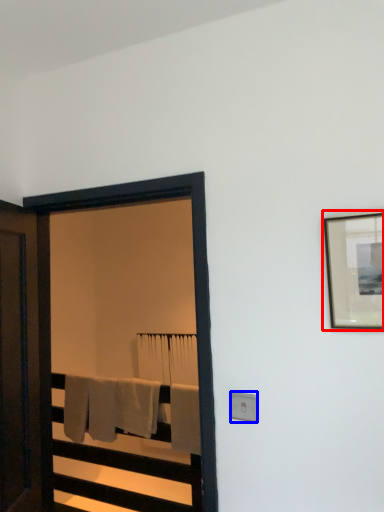
Question: Which point is further to the camera, picture frame (highlighted by a red box) or electric outlet (highlighted by a blue box)?

Choices:
 (A) picture frame
 (B) electric outlet

Answer: (B)